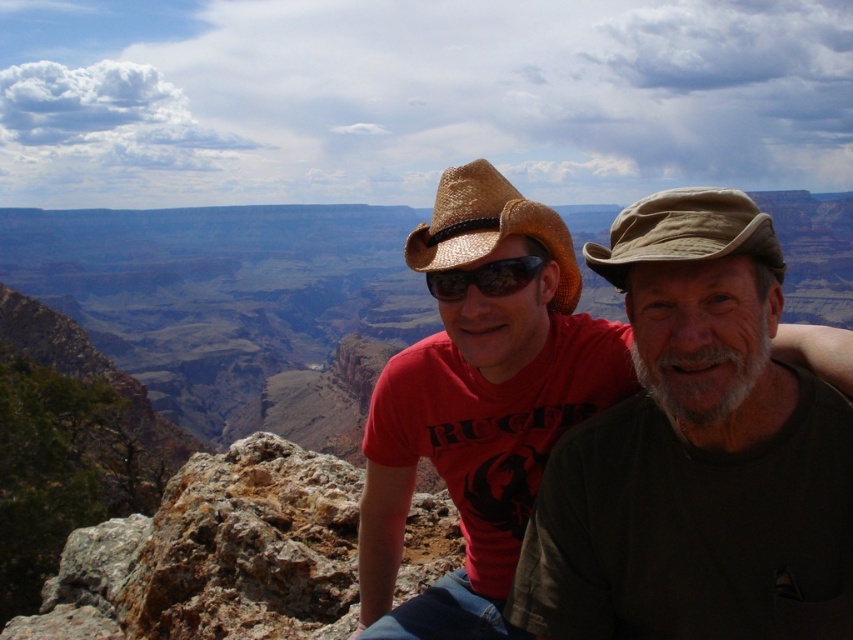
You are a photographer trying to capture a closeup of the dark green fabric shirt at center and the strawhat at center. Which object is wider when viewed from your camera lens?

The dark green fabric shirt at center is wider than the strawhat at center according to the description provided.

You are a photographer trying to capture the dark green fabric shirt at center in the image. Where exactly should you focus your camera lens to ensure the shirt is in sharp focus?

To ensure the dark green fabric shirt at center is in sharp focus, you should focus your camera lens precisely at point coordinates (695, 452).

Looking at this image, you are a photographer trying to capture a closeup shot of the tan fabric cowboy hat at upper right and the matte black goggles at center. Since your camera can only focus on one object at a time, which object should you choose to ensure it appears larger in the photo?

The tan fabric cowboy hat at upper right should be chosen because its width is larger than the matte black goggles at center, making it better suited for a closeup to appear larger in the photo.